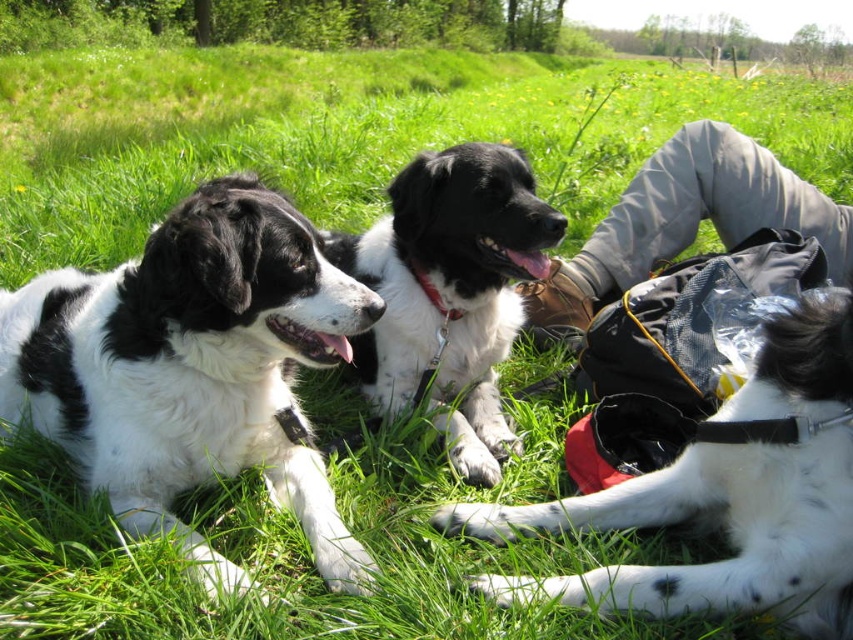
Question: Is white-spotted fur dog at center smaller than black/white fur dog at center?

Choices:
 (A) yes
 (B) no

Answer: (A)

Question: Which is nearer to the white-spotted fur dog at center?

Choices:
 (A) black/white fur dog at center
 (B) gray fabric pants at upper right

Answer: (A)

Question: Among these objects, which one is nearest to the camera?

Choices:
 (A) black/white fur dog at center
 (B) black and white fur at left

Answer: (B)

Question: Is black and white fur at left to the right of gray fabric pants at upper right from the viewer's perspective?

Choices:
 (A) yes
 (B) no

Answer: (B)

Question: Which point is closer to the camera?

Choices:
 (A) (32, 360)
 (B) (508, 451)

Answer: (A)

Question: Does white-spotted fur dog at center appear over gray fabric pants at upper right?

Choices:
 (A) yes
 (B) no

Answer: (B)